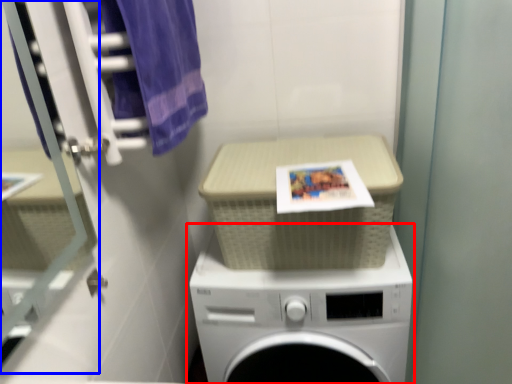
Question: Which of the following is the farthest to the observer, washing machine (highlighted by a red box) or glass door (highlighted by a blue box)?

Choices:
 (A) washing machine
 (B) glass door

Answer: (A)